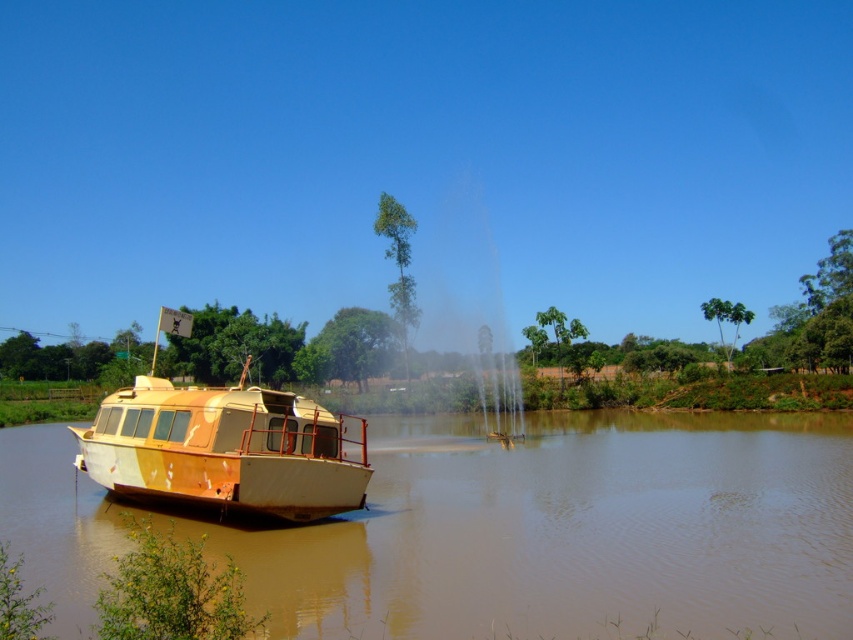
Question: Is brown matte boat at left smaller than rusty metal boat at left?

Choices:
 (A) no
 (B) yes

Answer: (B)

Question: Observing the image, what is the correct spatial positioning of brown matte boat at left in reference to rusty metal boat at left?

Choices:
 (A) below
 (B) above

Answer: (A)

Question: In this image, where is brown matte boat at left located relative to rusty metal boat at left?

Choices:
 (A) below
 (B) above

Answer: (A)

Question: Which point appears closest to the camera in this image?

Choices:
 (A) (227, 500)
 (B) (641, 554)

Answer: (B)

Question: Among these points, which one is farthest from the camera?

Choices:
 (A) (387, 506)
 (B) (137, 490)

Answer: (A)